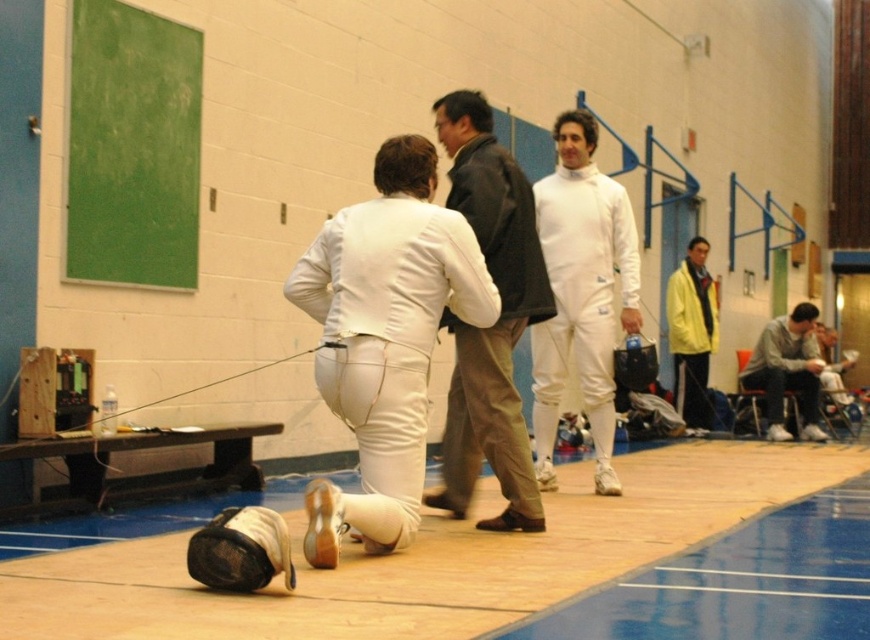
Between yellow jacket at right and gray cotton sweatshirt at right, which one is positioned higher?

yellow jacket at right

Does yellow jacket at right appear under gray cotton sweatshirt at right?

Actually, yellow jacket at right is above gray cotton sweatshirt at right.

Identify the location of yellow jacket at right. This screenshot has width=870, height=640. (691, 333).

Between white leather jacket at center and gray cotton sweatshirt at right, which one appears on the right side from the viewer's perspective?

gray cotton sweatshirt at right

Who is lower down, white leather jacket at center or gray cotton sweatshirt at right?

gray cotton sweatshirt at right is below.

Where is `white leather jacket at center`? The height and width of the screenshot is (640, 870). white leather jacket at center is located at coordinates (494, 323).

Between point (470, 458) and point (686, 259), which one is positioned behind?

Positioned behind is point (686, 259).

Who is lower down, white leather jacket at center or yellow jacket at right?

yellow jacket at right is lower down.

Identify the location of white leather jacket at center. The width and height of the screenshot is (870, 640). tap(494, 323).